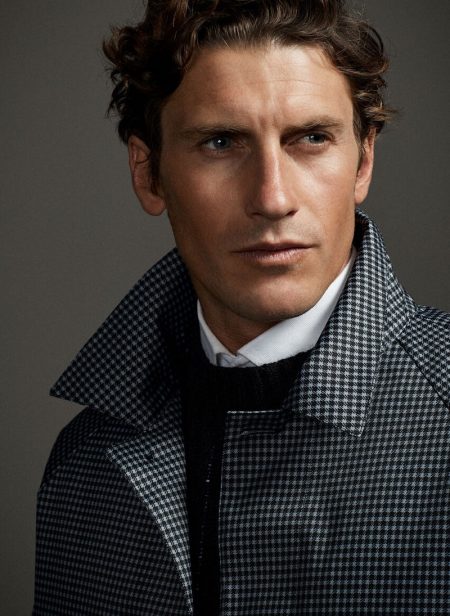
Locate an element on the screen. The width and height of the screenshot is (450, 616). coat is located at coordinates (311, 525).